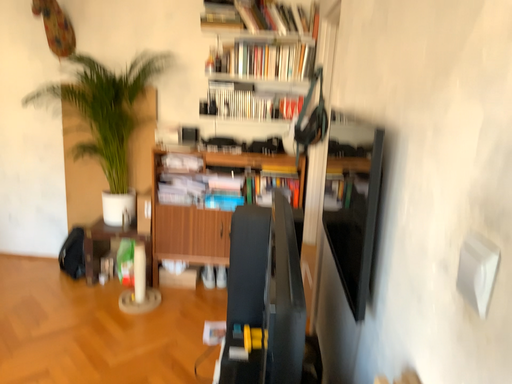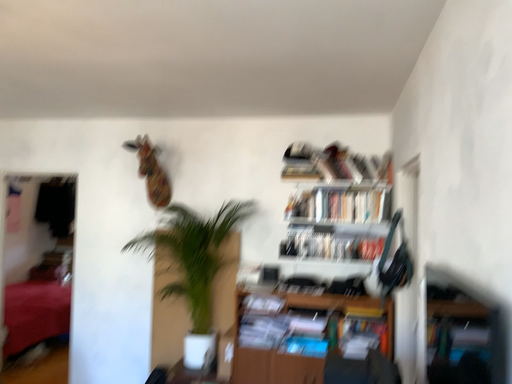
Question: How did the camera likely rotate when shooting the video?

Choices:
 (A) rotated left
 (B) rotated right

Answer: (A)